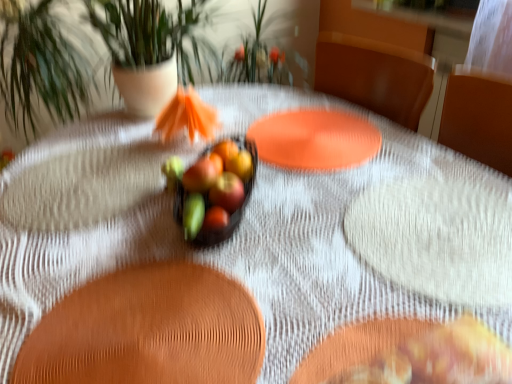
At what (x,y) coordinates should I click in order to perform the action: click on free location in front of green matte flower at center. Please return your answer as a coordinate pair (x, y). This screenshot has height=384, width=512. Looking at the image, I should click on (x=206, y=272).